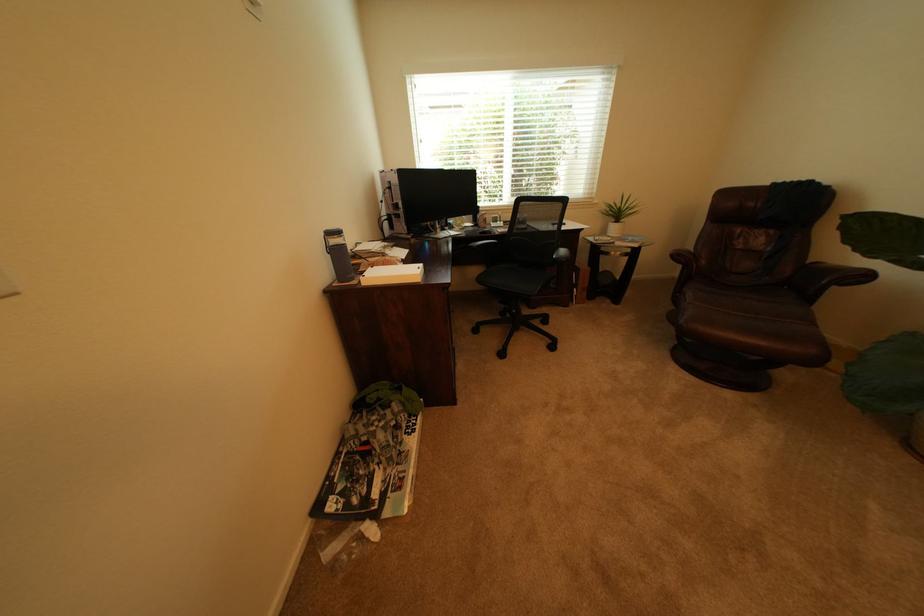
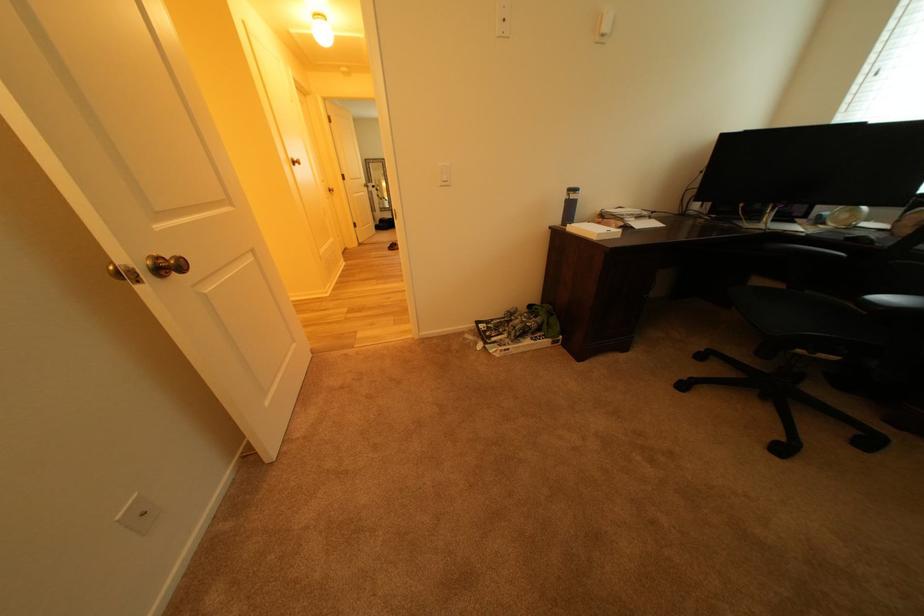
Based on the continuous images, in which direction is the camera rotating?

The rotation direction of the camera is left-down.